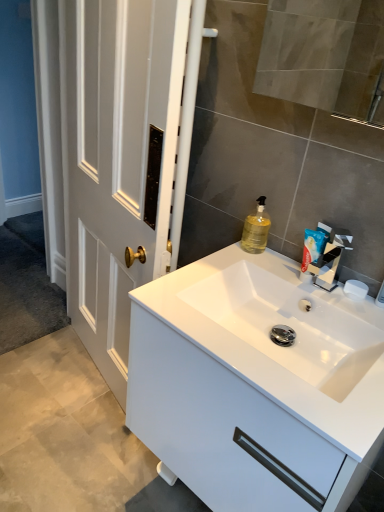
This screenshot has width=384, height=512. What are the coordinates of `vacant space situated on the left part of silver metallic tap at upper right` in the screenshot? It's located at (258, 272).